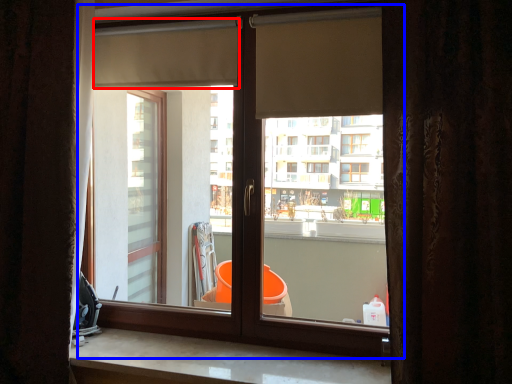
Question: Among these objects, which one is nearest to the camera, shutter (highlighted by a red box) or window (highlighted by a blue box)?

Choices:
 (A) shutter
 (B) window

Answer: (B)